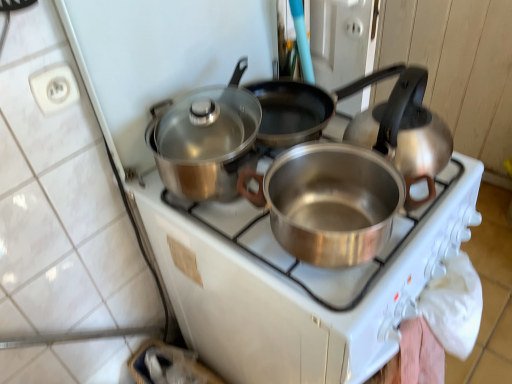
What are the coordinates of `vacant space in silver metallic pot at center (from a real-world perspective)` in the screenshot? It's located at (328, 230).